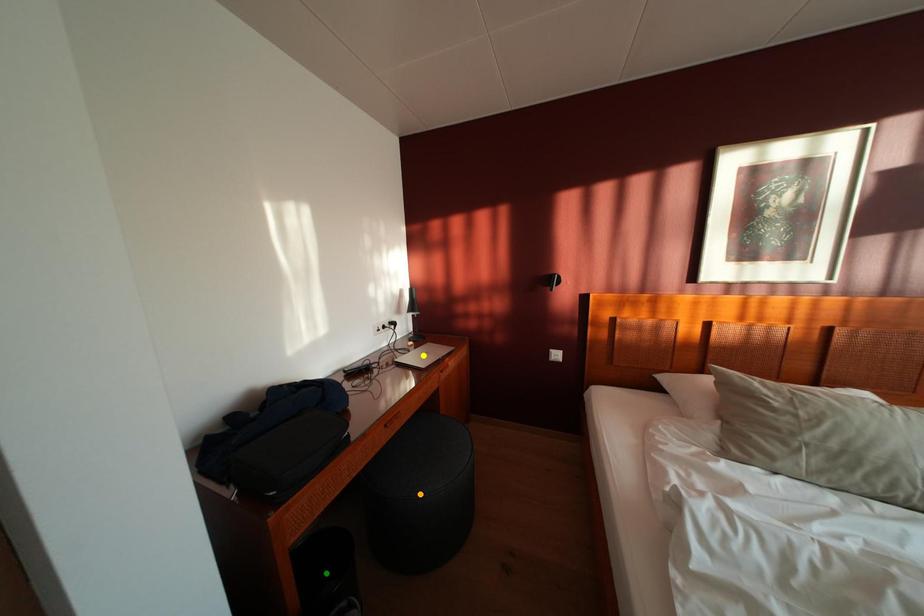
Order these from nearest to farthest:
- green point
- yellow point
- orange point

green point
orange point
yellow point